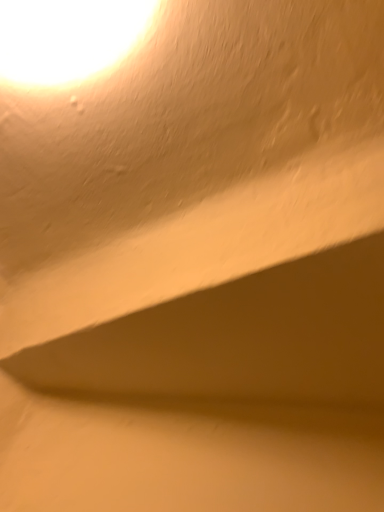
Question: Should I look upward or downward to see matte yellow light at upper left?

Choices:
 (A) up
 (B) down

Answer: (A)